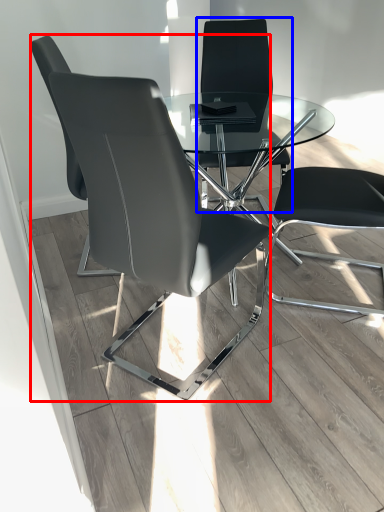
Question: Among these objects, which one is farthest to the camera, chair (highlighted by a red box) or chair (highlighted by a blue box)?

Choices:
 (A) chair
 (B) chair

Answer: (B)